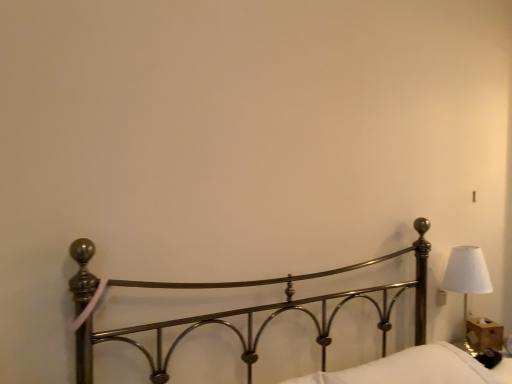
Question: Should I look upward or downward to see white fabric lampshade at right?

Choices:
 (A) down
 (B) up

Answer: (A)

Question: Considering the relative positions of white soft pillow at lower right and white fabric lampshade at right in the image provided, is white soft pillow at lower right to the left of white fabric lampshade at right from the viewer's perspective?

Choices:
 (A) yes
 (B) no

Answer: (A)

Question: Would you say white soft pillow at lower right contains white fabric lampshade at right?

Choices:
 (A) no
 (B) yes

Answer: (A)

Question: Does white soft pillow at lower right have a larger size compared to white fabric lampshade at right?

Choices:
 (A) no
 (B) yes

Answer: (B)

Question: Is white soft pillow at lower right behind white fabric lampshade at right?

Choices:
 (A) yes
 (B) no

Answer: (B)

Question: Does white soft pillow at lower right have a smaller size compared to white fabric lampshade at right?

Choices:
 (A) yes
 (B) no

Answer: (B)

Question: From the image's perspective, would you say white soft pillow at lower right is shown under white fabric lampshade at right?

Choices:
 (A) yes
 (B) no

Answer: (A)

Question: Is white fabric lampshade at right oriented away from wooden tissue box at lower right?

Choices:
 (A) no
 (B) yes

Answer: (A)

Question: Can you confirm if white fabric lampshade at right is thinner than wooden tissue box at lower right?

Choices:
 (A) yes
 (B) no

Answer: (B)

Question: From a real-world perspective, is white fabric lampshade at right beneath wooden tissue box at lower right?

Choices:
 (A) no
 (B) yes

Answer: (A)

Question: Can you confirm if white fabric lampshade at right is positioned to the left of wooden tissue box at lower right?

Choices:
 (A) yes
 (B) no

Answer: (A)

Question: Does white fabric lampshade at right have a greater height compared to wooden tissue box at lower right?

Choices:
 (A) no
 (B) yes

Answer: (B)

Question: Is white fabric lampshade at right directly adjacent to wooden tissue box at lower right?

Choices:
 (A) no
 (B) yes

Answer: (A)

Question: Considering the relative sizes of polished metal bed at center and white soft pillow at lower right in the image provided, is polished metal bed at center shorter than white soft pillow at lower right?

Choices:
 (A) yes
 (B) no

Answer: (B)